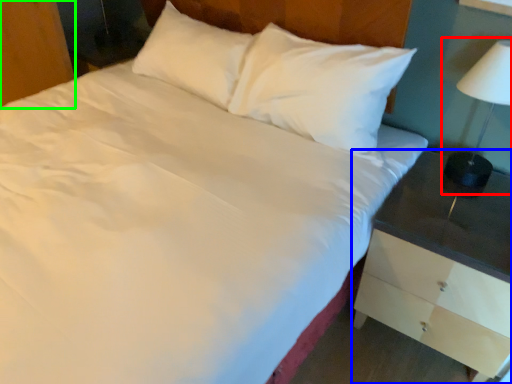
Question: Which is farther away from bedside lamp (highlighted by a red box)? nightstand (highlighted by a blue box) or dresser (highlighted by a green box)?

Choices:
 (A) nightstand
 (B) dresser

Answer: (B)